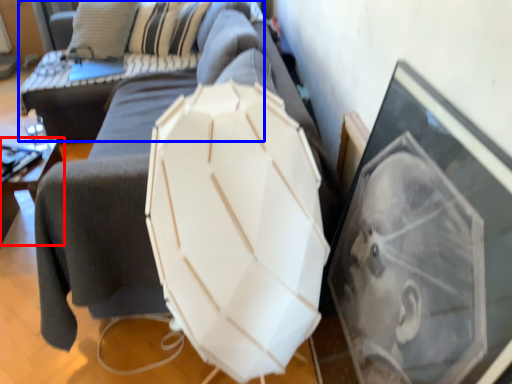
Question: Which object appears closest to the camera in this image, furniture (highlighted by a red box) or couch (highlighted by a blue box)?

Choices:
 (A) furniture
 (B) couch

Answer: (A)